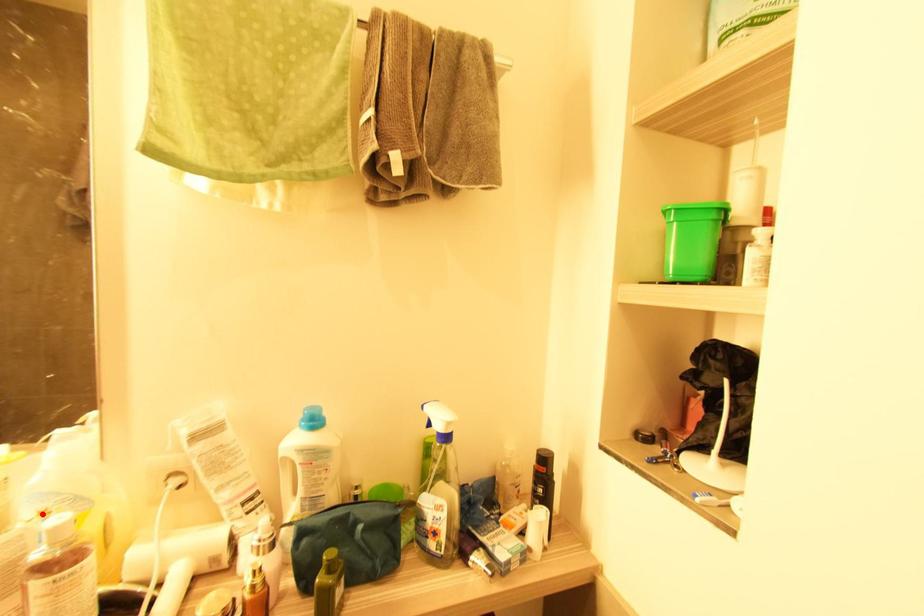
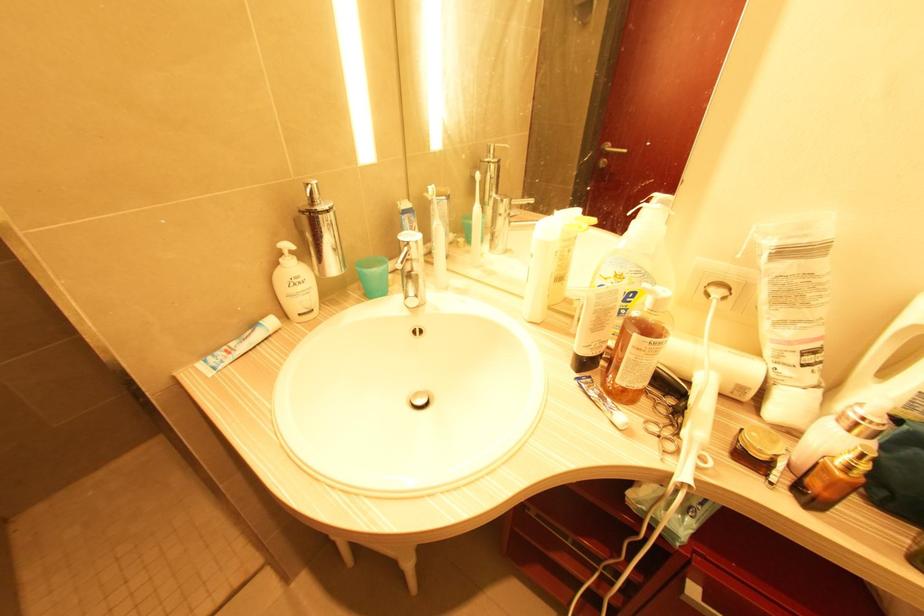
Question: I am providing you with two images of the same scene from different viewpoints. Given a red point in image1, look at the same physical point in image2. Is it:

Choices:
 (A) Closer to the viewpoint
 (B) Farther from the viewpoint

Answer: (A)